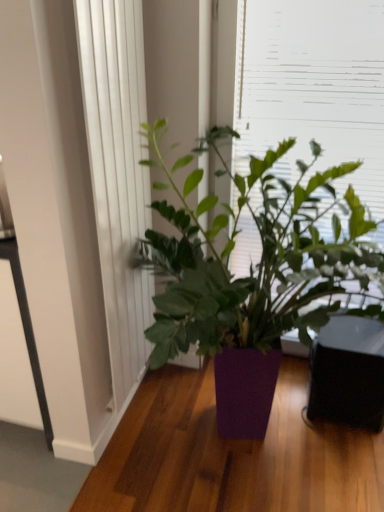
Question: In the image, is green leafy plant at upper center positioned in front of or behind white textured curtain at left?

Choices:
 (A) behind
 (B) front

Answer: (A)

Question: Considering the positions of green leafy plant at upper center and white textured curtain at left in the image, is green leafy plant at upper center wider or thinner than white textured curtain at left?

Choices:
 (A) thin
 (B) wide

Answer: (B)

Question: Based on their relative distances, which object is nearer to the purple matte plant at center?

Choices:
 (A) green leafy plant at upper center
 (B) white textured curtain at left

Answer: (A)

Question: Estimate the real-world distances between objects in this image. Which object is closer to the white textured curtain at left?

Choices:
 (A) purple matte plant at center
 (B) green leafy plant at upper center

Answer: (A)